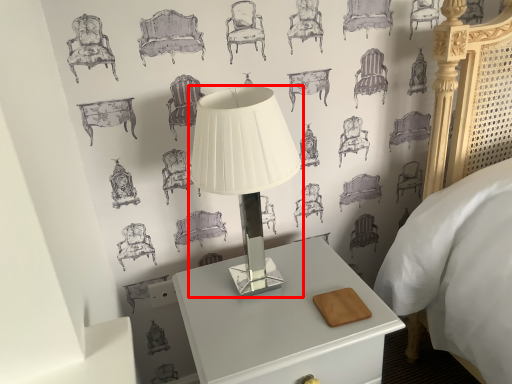
Question: From the image's perspective, where is lamp (annotated by the red box) located in relation to nightstand in the image?

Choices:
 (A) below
 (B) above

Answer: (B)